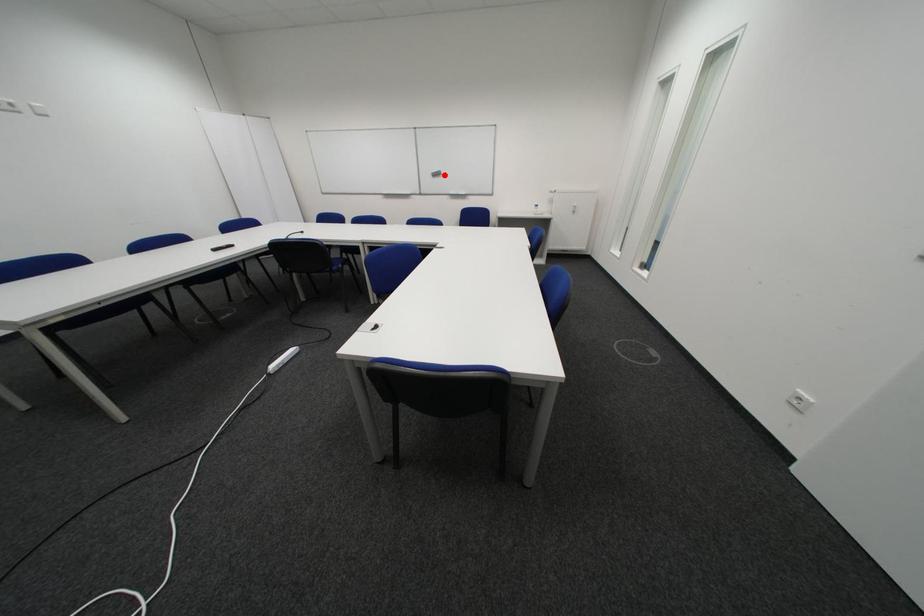
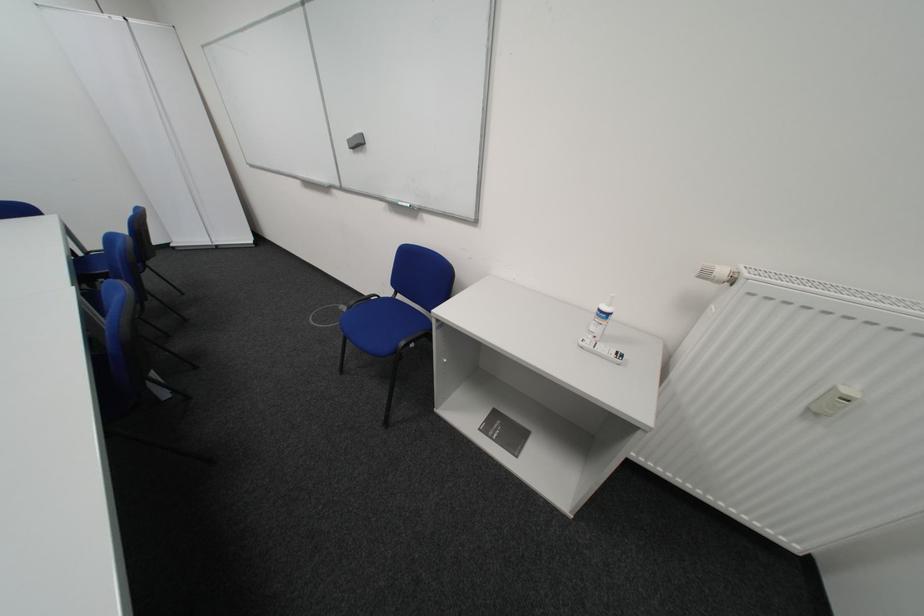
Where in the second image is the point corresponding to the highlighted location from the first image?

(361, 143)